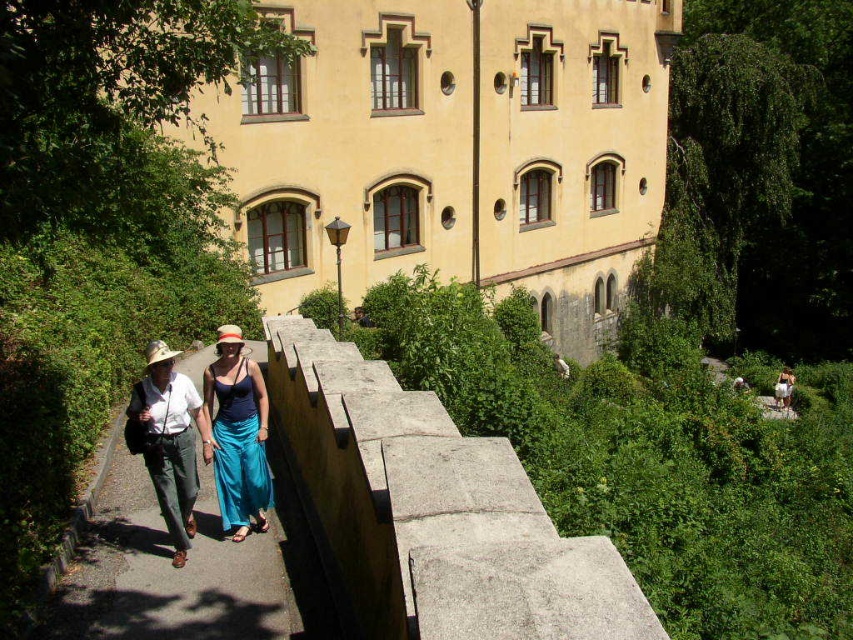
From the picture: You are standing at the entrance of the castle complex and want to reach the concrete paved path at center. According to the coordinates provided, in which direction should you head from your current position?

The concrete paved path at center is located at coordinates point (167, 573). Since coordinates typically indicate easting and northing values, you should head towards the east and slightly north from your current position at the entrance to reach it.

You are a photographer planning to capture a wide shot of the scene. The camera you are using has a maximum width of 2 meters. Given that the concrete paved path at center and the teal satin dress at center are both in the frame, will the camera be able to capture both objects without cropping?

The concrete paved path at center is wider than the teal satin dress at center. Since the camera has a maximum width of 2 meters, it can capture both objects as long as their combined width does not exceed 2 meters. However, the exact dimensions are not provided, so we cannot definitively confirm if they will fit without additional information.

You are a tour guide leading visitors through the castle grounds. You need to ensure that the visitors can walk comfortably on the concrete paved path at center while also admiring the blue silk dress at center worn by a visitor. Can the visitors walk on the path without the dress getting in the way?

The concrete paved path at center is larger in size than blue silk dress at center, so visitors can walk comfortably on the path without the dress obstructing their way.